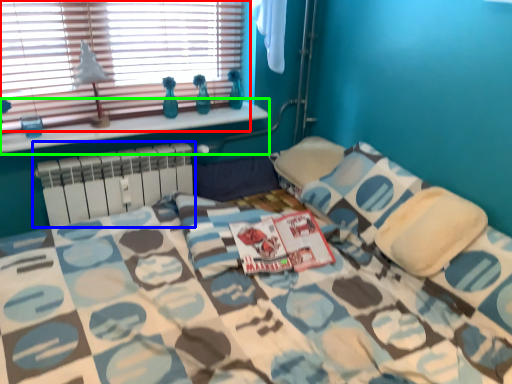
Question: Considering the real-world distances, which object is farthest from window (highlighted by a red box)? radiator (highlighted by a blue box) or window sill (highlighted by a green box)?

Choices:
 (A) radiator
 (B) window sill

Answer: (A)